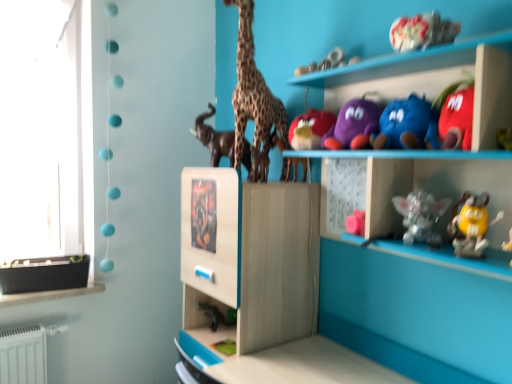
Question: From a real-world perspective, is satin silver figurine at center-right, the third toy positioned from the bottom, under yellow rubber duck at lower right, which ranks as the second toy in bottom-to-top order?

Choices:
 (A) no
 (B) yes

Answer: (B)

Question: Does satin silver figurine at center-right, the third toy positioned from the bottom, have a lesser height compared to yellow rubber duck at lower right, which appears as the seventh toy when viewed from the top?

Choices:
 (A) no
 (B) yes

Answer: (A)

Question: Can you confirm if satin silver figurine at center-right, the third toy positioned from the bottom, is smaller than yellow rubber duck at lower right, which appears as the seventh toy when viewed from the top?

Choices:
 (A) yes
 (B) no

Answer: (B)

Question: Does satin silver figurine at center-right, which is the sixth toy in top-to-bottom order, have a greater width compared to yellow rubber duck at lower right, which ranks as the second toy in bottom-to-top order?

Choices:
 (A) no
 (B) yes

Answer: (B)

Question: Would you say yellow rubber duck at lower right, which appears as the seventh toy when viewed from the top, is part of satin silver figurine at center-right, the third toy positioned from the bottom,'s contents?

Choices:
 (A) yes
 (B) no

Answer: (B)

Question: In terms of size, does matte plush bird at center, which is counted as the fifth toy, starting from the bottom, appear bigger or smaller than metallic silver dragon at center?

Choices:
 (A) big
 (B) small

Answer: (A)

Question: Would you say matte plush bird at center, the 4th toy in the top-to-bottom sequence, is to the left or to the right of metallic silver dragon at center in the picture?

Choices:
 (A) right
 (B) left

Answer: (A)

Question: From a real-world perspective, is matte plush bird at center, which is counted as the fifth toy, starting from the bottom, positioned above or below metallic silver dragon at center?

Choices:
 (A) above
 (B) below

Answer: (A)

Question: Considering their positions, is matte plush bird at center, the 4th toy in the top-to-bottom sequence, located in front of or behind metallic silver dragon at center?

Choices:
 (A) behind
 (B) front

Answer: (B)

Question: Is metallic silver dragon at center situated inside spotted fur giraffe at center or outside?

Choices:
 (A) outside
 (B) inside

Answer: (A)

Question: From a real-world perspective, is metallic silver dragon at center physically located above or below spotted fur giraffe at center?

Choices:
 (A) below
 (B) above

Answer: (A)

Question: Would you say metallic silver dragon at center is to the left or to the right of spotted fur giraffe at center in the picture?

Choices:
 (A) right
 (B) left

Answer: (B)

Question: In terms of size, does metallic silver dragon at center appear bigger or smaller than spotted fur giraffe at center?

Choices:
 (A) small
 (B) big

Answer: (A)

Question: From their relative heights in the image, would you say matte plush bird at center, which is counted as the fifth toy, starting from the bottom, is taller or shorter than satin silver figurine at center-right, which is the sixth toy in top-to-bottom order?

Choices:
 (A) tall
 (B) short

Answer: (B)

Question: Is matte plush bird at center, which is counted as the fifth toy, starting from the bottom, wider or thinner than satin silver figurine at center-right, the third toy positioned from the bottom?

Choices:
 (A) wide
 (B) thin

Answer: (A)